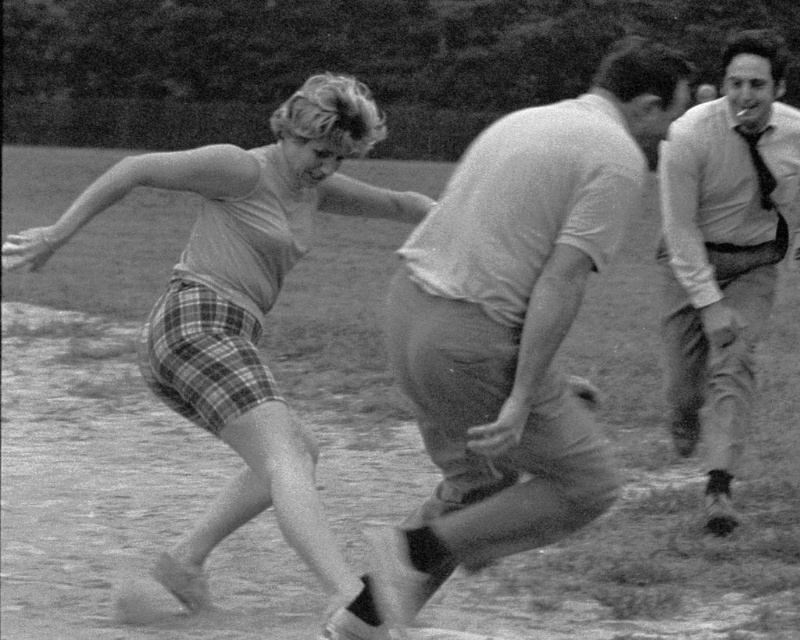
In the scene, there are two people wearing plaid shorts at left and light beige shirt at right. Which clothing item takes up more space in the image?

The light beige shirt at right takes up more space in the image than the plaid shorts at left.

In the scene, there are two people wearing shirts. One has a smooth cotton shirt at center and the other has a light beige shirt at right. Which shirt is shorter?

The smooth cotton shirt at center is shorter than the light beige shirt at right.